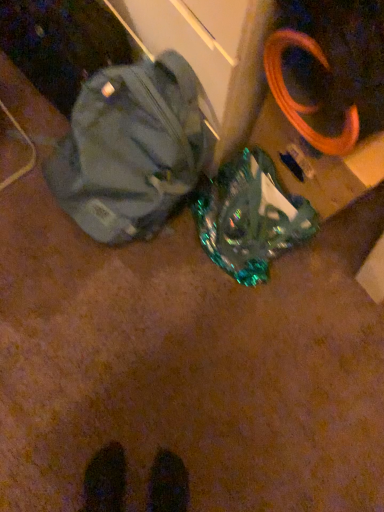
Question: From the image's perspective, is matte gray backpack at center below holographic plastic bag at center?

Choices:
 (A) yes
 (B) no

Answer: (B)

Question: Can you confirm if matte gray backpack at center is shorter than holographic plastic bag at center?

Choices:
 (A) yes
 (B) no

Answer: (B)

Question: Is the depth of matte gray backpack at center less than that of holographic plastic bag at center?

Choices:
 (A) yes
 (B) no

Answer: (A)

Question: Is matte gray backpack at center wider than holographic plastic bag at center?

Choices:
 (A) no
 (B) yes

Answer: (B)

Question: Is matte gray backpack at center to the right of holographic plastic bag at center from the viewer's perspective?

Choices:
 (A) no
 (B) yes

Answer: (A)

Question: Does matte gray backpack at center have a larger size compared to holographic plastic bag at center?

Choices:
 (A) no
 (B) yes

Answer: (B)

Question: From the image's perspective, would you say holographic plastic bag at center is shown under matte gray backpack at center?

Choices:
 (A) yes
 (B) no

Answer: (A)

Question: Are holographic plastic bag at center and matte gray backpack at center far apart?

Choices:
 (A) no
 (B) yes

Answer: (A)

Question: Does holographic plastic bag at center turn towards matte gray backpack at center?

Choices:
 (A) yes
 (B) no

Answer: (B)

Question: Does holographic plastic bag at center have a larger size compared to matte gray backpack at center?

Choices:
 (A) no
 (B) yes

Answer: (A)

Question: Is holographic plastic bag at center taller than matte gray backpack at center?

Choices:
 (A) yes
 (B) no

Answer: (B)

Question: Is holographic plastic bag at center looking in the opposite direction of matte gray backpack at center?

Choices:
 (A) no
 (B) yes

Answer: (A)

Question: From their relative heights in the image, would you say holographic plastic bag at center is taller or shorter than matte gray backpack at center?

Choices:
 (A) tall
 (B) short

Answer: (B)